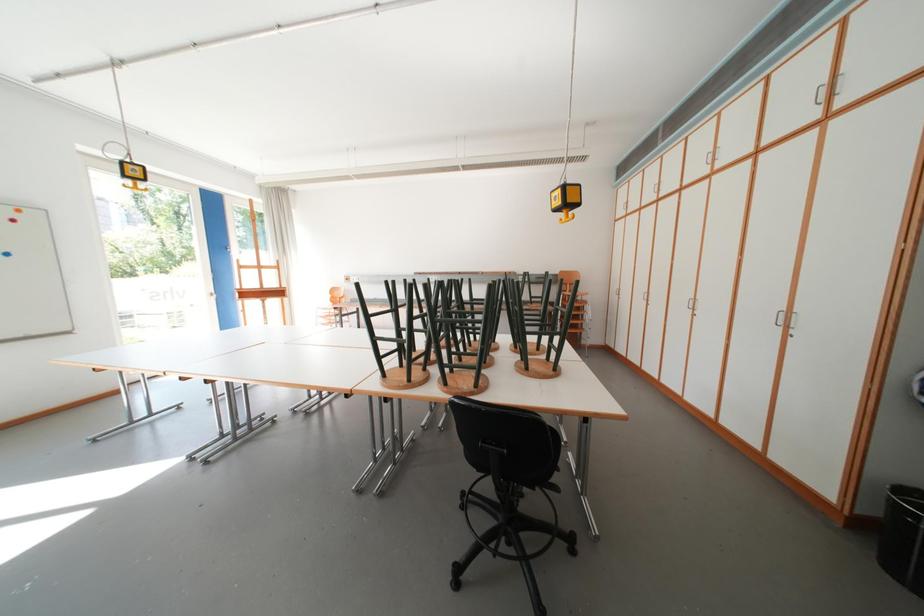
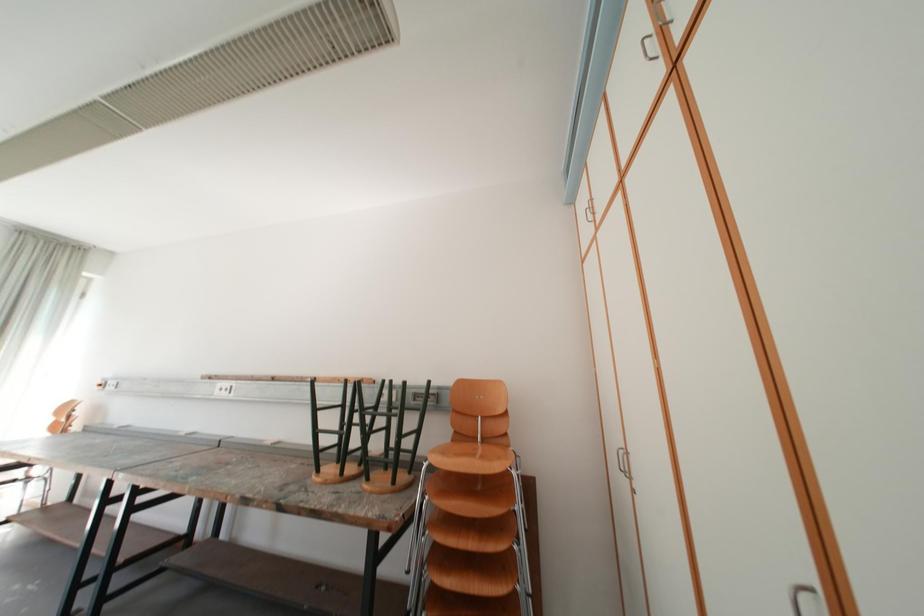
What movement of the cameraman would produce the second image?

The cameraman moved toward right, forward.